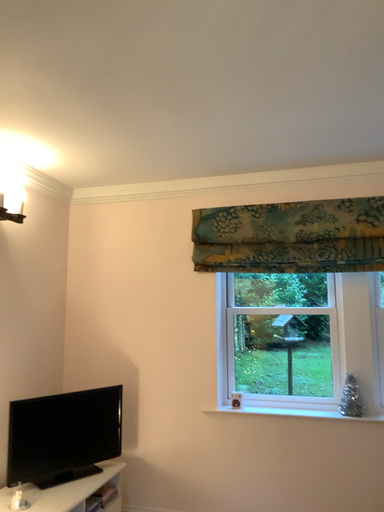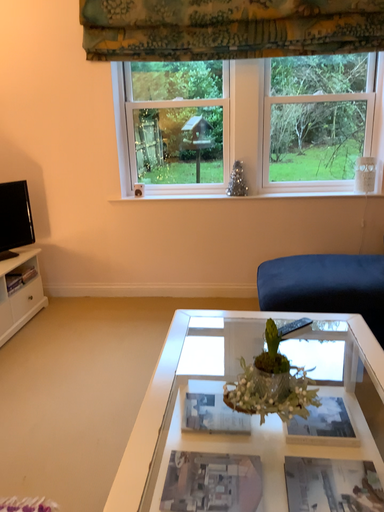
Question: How did the camera likely rotate when shooting the video?

Choices:
 (A) rotated upward
 (B) rotated downward

Answer: (B)